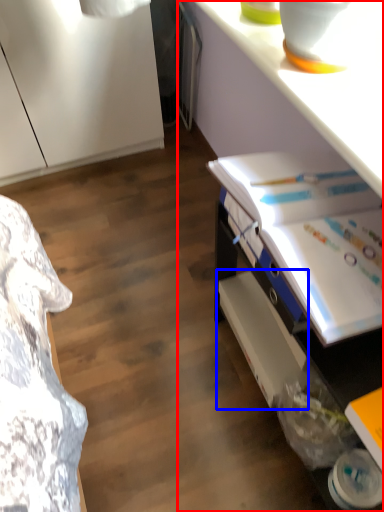
Question: Which point is further to the camera, desk (highlighted by a red box) or shelf (highlighted by a blue box)?

Choices:
 (A) desk
 (B) shelf

Answer: (B)